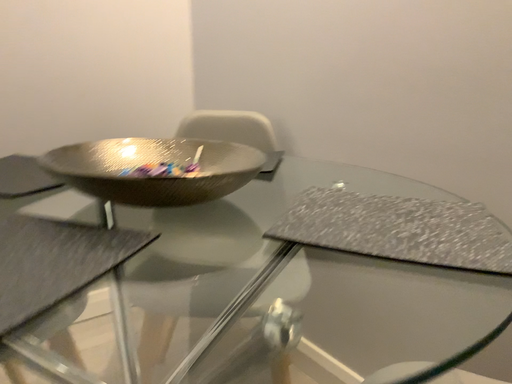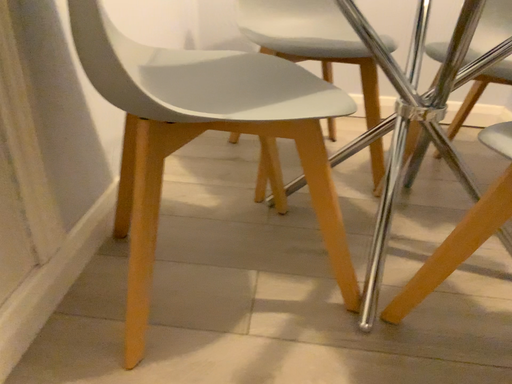
Question: How did the camera likely rotate when shooting the video?

Choices:
 (A) rotated downward
 (B) rotated upward

Answer: (A)